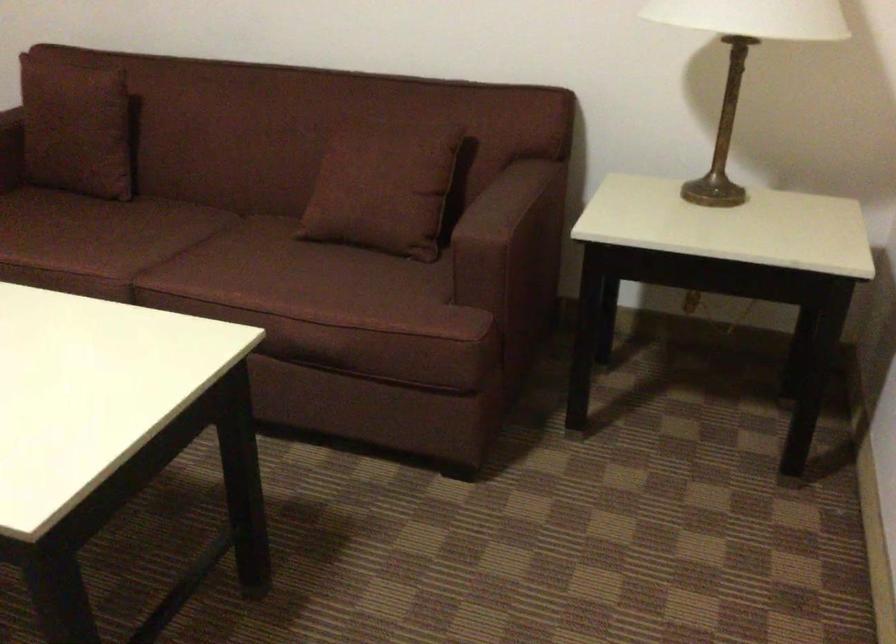
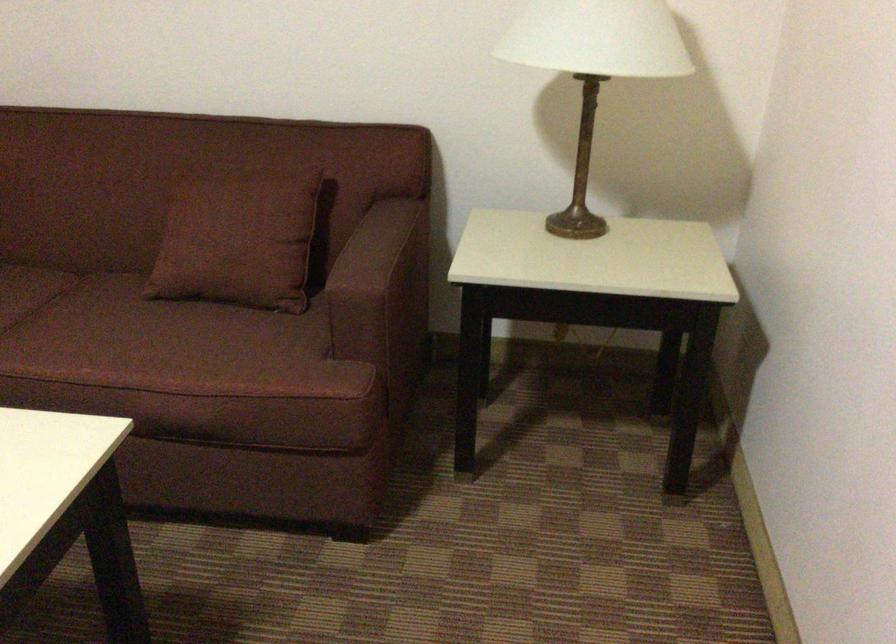
In the second image, find the point that corresponds to (280,272) in the first image.

(135, 339)